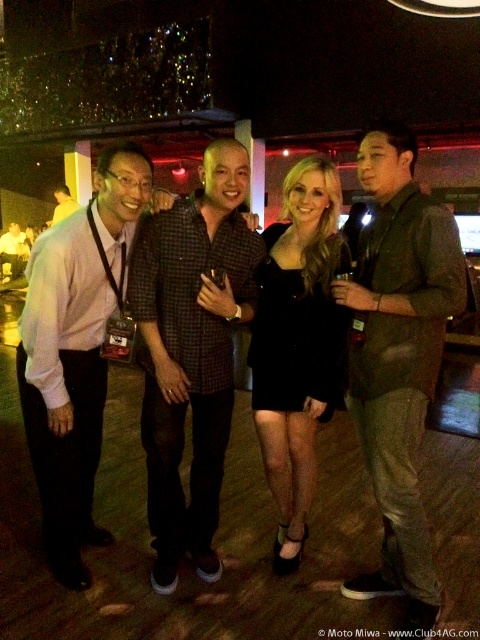
Which is below, checkered fabric shirt at center or light pink shirt at left?

light pink shirt at left

Is checkered fabric shirt at center below light pink shirt at left?

Incorrect, checkered fabric shirt at center is not positioned below light pink shirt at left.

Does point (152, 460) come closer to viewer compared to point (84, 513)?

Yes.

I want to click on checkered fabric shirt at center, so click(192, 352).

Between shiny dark gray suit at right and checkered fabric shirt at center, which one has less height?

With less height is checkered fabric shirt at center.

Who is more distant from viewer, (364, 156) or (144, 305)?

Positioned behind is point (144, 305).

Image resolution: width=480 pixels, height=640 pixels. Identify the location of shiny dark gray suit at right. (398, 355).

Is shiny dark gray suit at right behind matte black shirt at left?

No, it is not.

Where is `shiny dark gray suit at right`? shiny dark gray suit at right is located at coordinates (398, 355).

Locate an element on the screen. This screenshot has height=640, width=480. shiny dark gray suit at right is located at coordinates (398, 355).